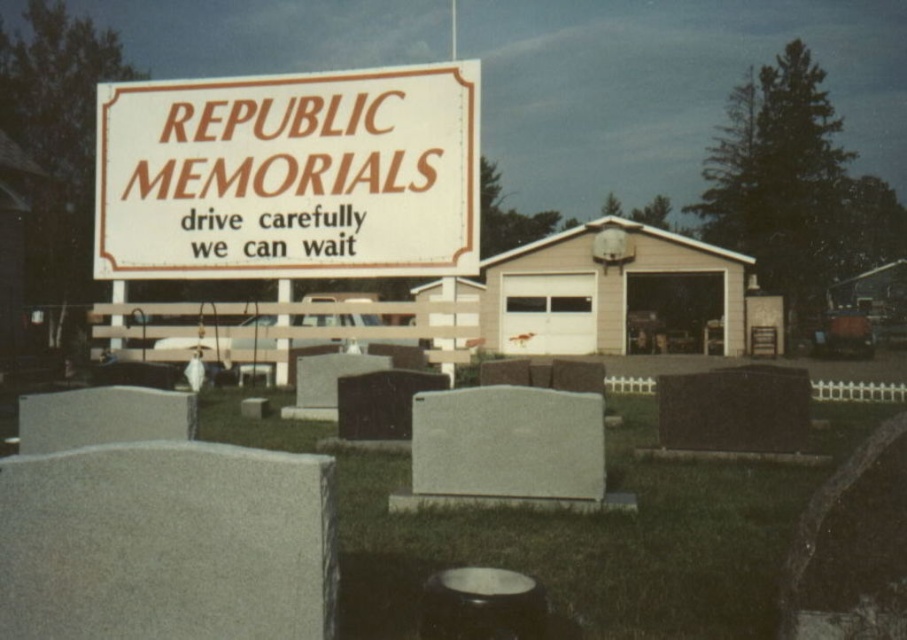
You are standing at the entrance of the cemetery and see the white plastic sign at upper center and the gray granite gravestone at center. Which object is shorter?

The white plastic sign at upper center is shorter than the gray granite gravestone at center.

You are a visitor at the cemetery and want to read the text on the gray granite gravestone at center. However, there is a white plastic sign at upper center blocking your view. Can you move around to see the gravestone clearly?

The gray granite gravestone at center is behind the white plastic sign at upper center, so moving around might allow you to see the gravestone by going around the sign or moving to a position where the sign is no longer blocking your view.

You are standing at the entrance of the cemetery and want to locate the gray granite gravestone at center. Which direction should you look relative to the white plastic sign at upper center?

The gray granite gravestone at center is to the right of the white plastic sign at upper center.